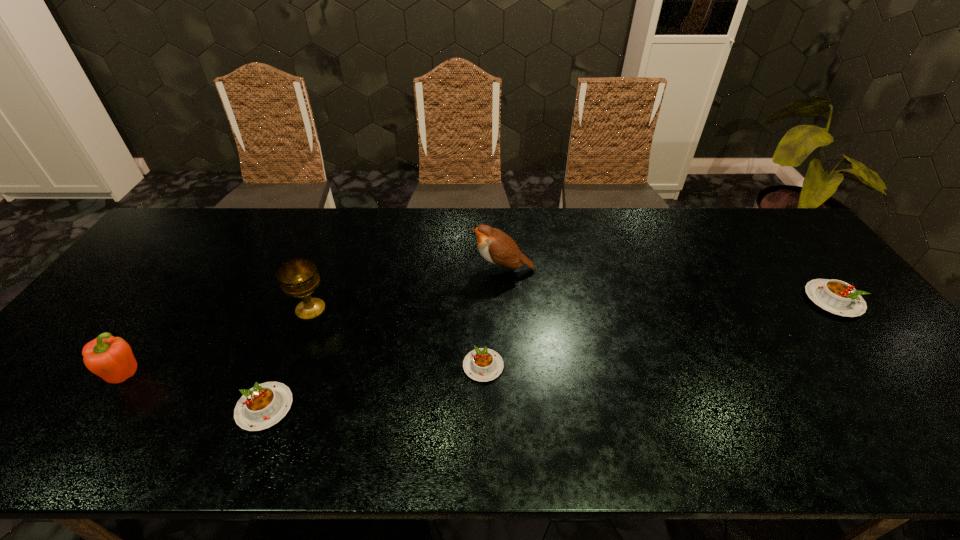
To ensure equal spacing by inserting another pudding among them, please point out a vacant spot for this new pudding. Please provide its 2D coordinates. Your answer should be formatted as a tuple, i.e. [(x, y)], where the tuple contains the x and y coordinates of a point satisfying the conditions above.

[(671, 331)]